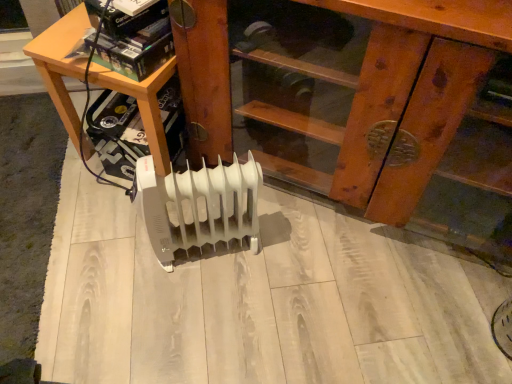
Question: Is wooden at left positioned before white plastic heater at center?

Choices:
 (A) yes
 (B) no

Answer: (B)

Question: From the image's perspective, is wooden at left below white plastic heater at center?

Choices:
 (A) no
 (B) yes

Answer: (A)

Question: Does wooden at left have a lesser width compared to white plastic heater at center?

Choices:
 (A) no
 (B) yes

Answer: (A)

Question: Is wooden at left not within white plastic heater at center?

Choices:
 (A) no
 (B) yes

Answer: (B)

Question: Is wooden at left not near white plastic heater at center?

Choices:
 (A) no
 (B) yes

Answer: (A)

Question: From a real-world perspective, is white plastic heater at center positioned above or below white plastic heater at center?

Choices:
 (A) above
 (B) below

Answer: (B)

Question: Relative to white plastic heater at center, is white plastic heater at center in front or behind?

Choices:
 (A) behind
 (B) front

Answer: (A)

Question: Is point (205, 230) positioned closer to the camera than point (46, 64)?

Choices:
 (A) farther
 (B) closer

Answer: (A)

Question: Is white plastic heater at center bigger or smaller than white plastic heater at center?

Choices:
 (A) small
 (B) big

Answer: (A)

Question: From a real-world perspective, relative to white plastic heater at center, is wooden at left vertically above or below?

Choices:
 (A) below
 (B) above

Answer: (B)

Question: Is wooden at left spatially inside white plastic heater at center, or outside of it?

Choices:
 (A) inside
 (B) outside

Answer: (B)

Question: Is wooden at left bigger or smaller than white plastic heater at center?

Choices:
 (A) small
 (B) big

Answer: (B)

Question: In the image, is wooden at left positioned in front of or behind white plastic heater at center?

Choices:
 (A) front
 (B) behind

Answer: (B)

Question: Is white plastic heater at center in front of or behind wooden at left in the image?

Choices:
 (A) behind
 (B) front

Answer: (B)

Question: In terms of size, does white plastic heater at center appear bigger or smaller than wooden at left?

Choices:
 (A) big
 (B) small

Answer: (B)